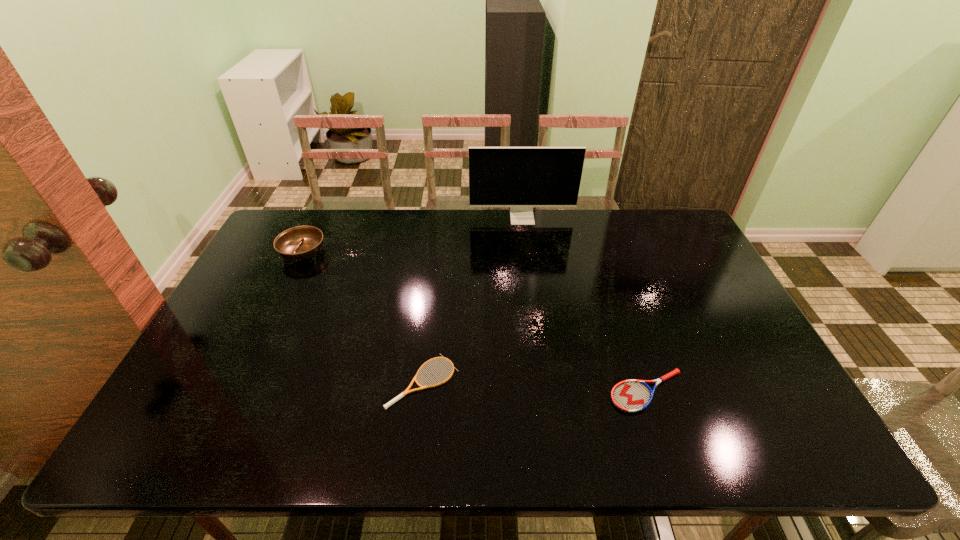
I want to click on monitor that is positioned at the far edge, so click(x=521, y=178).

Image resolution: width=960 pixels, height=540 pixels. I want to click on soup bowl at the far edge, so click(300, 243).

The height and width of the screenshot is (540, 960). In order to click on object located in the left edge section of the desktop in this screenshot , I will do `click(300, 243)`.

You are a GUI agent. You are given a task and a screenshot of the screen. Output one action in this format:
    pyautogui.click(x=<x>, y=<y>)
    Task: Click on the object positioned at the far left corner
    
    Given the screenshot: What is the action you would take?
    pyautogui.click(x=300, y=243)

Where is `free space at the far edge of the desktop`? The height and width of the screenshot is (540, 960). free space at the far edge of the desktop is located at coordinates (575, 246).

Image resolution: width=960 pixels, height=540 pixels. In order to click on free spot at the near edge of the desktop in this screenshot , I will do `click(221, 446)`.

At what (x,y) coordinates should I click in order to perform the action: click on vacant space at the left edge of the desktop. Please return your answer as a coordinate pair (x, y). Looking at the image, I should click on (220, 386).

Find the location of a particular element. free spot at the right edge of the desktop is located at coordinates (747, 363).

In the image, there is a desktop. At what (x,y) coordinates should I click in order to perform the action: click on vacant space at the far right corner. Please return your answer as a coordinate pair (x, y). The width and height of the screenshot is (960, 540). Looking at the image, I should click on (667, 220).

In the image, there is a desktop. At what (x,y) coordinates should I click in order to perform the action: click on vacant space at the near right corner. Please return your answer as a coordinate pair (x, y). Looking at the image, I should click on (731, 420).